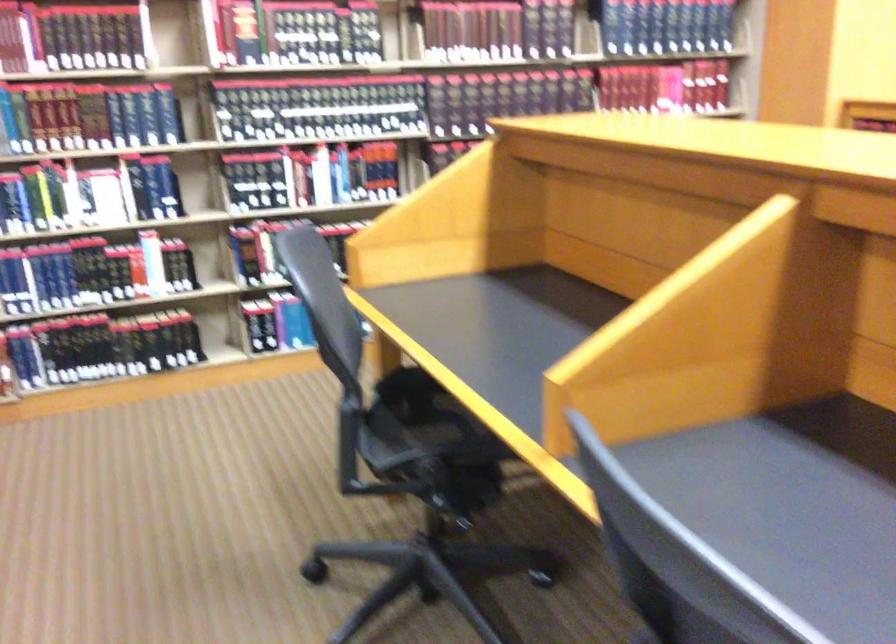
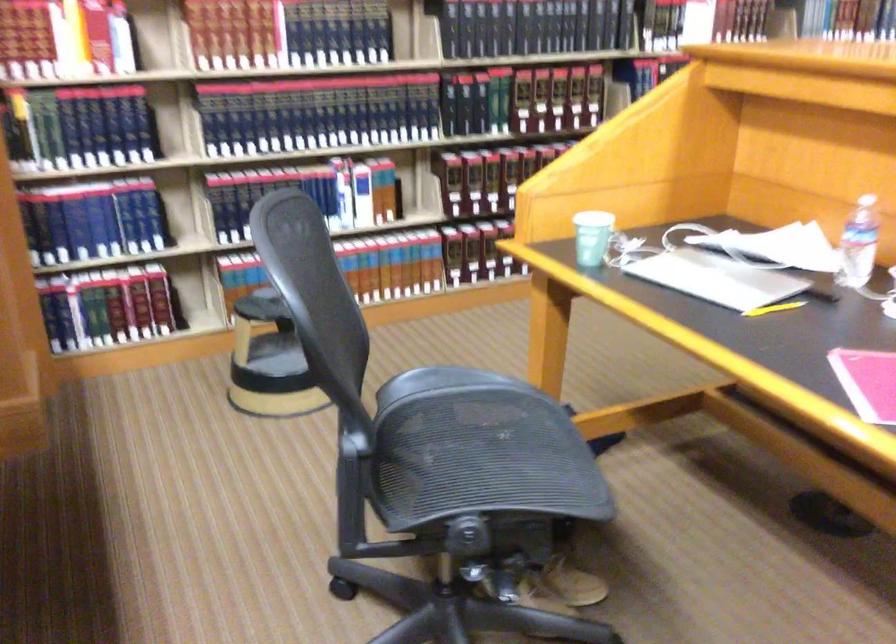
Question: What movement of the cameraman would produce the second image?

Choices:
 (A) Left
 (B) Right
 (C) Forward
 (D) Backward

Answer: (A)